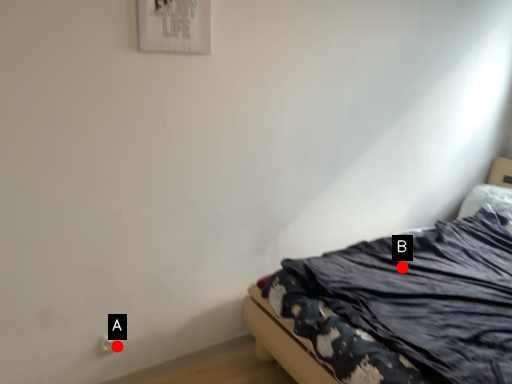
Question: Two points are circled on the image, labeled by A and B beside each circle. Which of the following is the closest to the observer?

Choices:
 (A) A is closer
 (B) B is closer

Answer: (A)